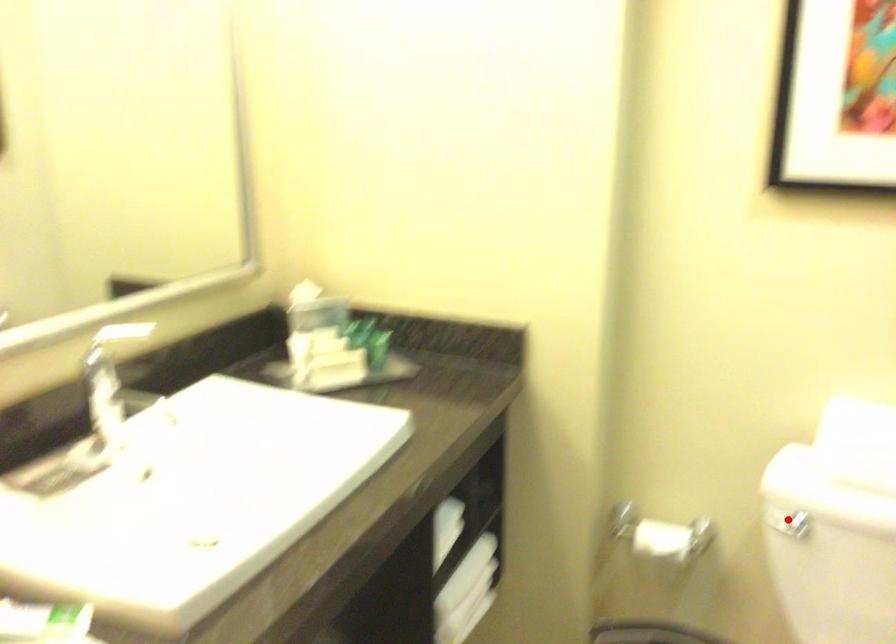
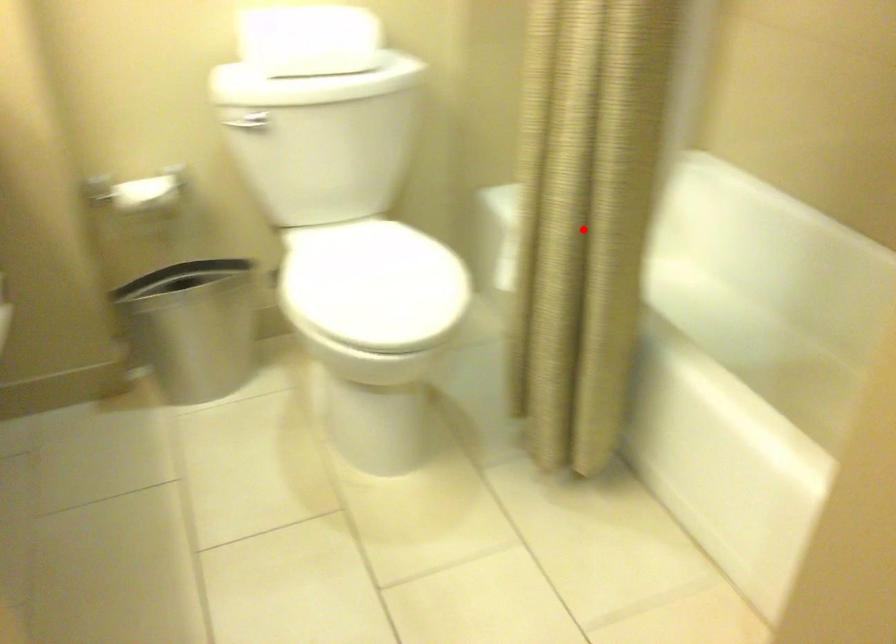
I am providing you with two images of the same scene from different viewpoints. A red point is marked on the first image and another point is marked on the second image. Is the marked point in image1 the same physical position as the marked point in image2?

No